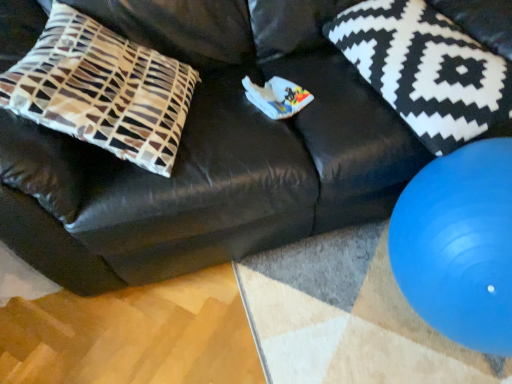
Question: Is brown and white patterned pillow at left, which ranks as the 1th pillow in left-to-right order, at the left side of blue rubber ball at lower right?

Choices:
 (A) yes
 (B) no

Answer: (A)

Question: Is brown and white patterned pillow at left, the 2th pillow from the right, facing away from blue rubber ball at lower right?

Choices:
 (A) no
 (B) yes

Answer: (A)

Question: Considering the relative positions of brown and white patterned pillow at left, which ranks as the 1th pillow in left-to-right order, and blue rubber ball at lower right in the image provided, is brown and white patterned pillow at left, which ranks as the 1th pillow in left-to-right order, in front of blue rubber ball at lower right?

Choices:
 (A) yes
 (B) no

Answer: (B)

Question: Does brown and white patterned pillow at left, the 2th pillow from the right, have a smaller size compared to blue rubber ball at lower right?

Choices:
 (A) yes
 (B) no

Answer: (B)

Question: Is brown and white patterned pillow at left, which ranks as the 1th pillow in left-to-right order, far away from blue rubber ball at lower right?

Choices:
 (A) yes
 (B) no

Answer: (B)

Question: Do you think black and white patterned pillow at upper right, the first pillow from the right, is within brown and white patterned pillow at left, which ranks as the 1th pillow in left-to-right order, or outside of it?

Choices:
 (A) inside
 (B) outside

Answer: (B)

Question: From a real-world perspective, is black and white patterned pillow at upper right, the first pillow from the right, above or below brown and white patterned pillow at left, which ranks as the 1th pillow in left-to-right order?

Choices:
 (A) above
 (B) below

Answer: (B)

Question: Considering the positions of black and white patterned pillow at upper right, the 2th pillow positioned from the left, and brown and white patterned pillow at left, the 2th pillow from the right, in the image, is black and white patterned pillow at upper right, the 2th pillow positioned from the left, taller or shorter than brown and white patterned pillow at left, the 2th pillow from the right,?

Choices:
 (A) tall
 (B) short

Answer: (B)

Question: Is point (471, 74) positioned closer to the camera than point (55, 124)?

Choices:
 (A) farther
 (B) closer

Answer: (A)

Question: Is point (481, 226) closer or farther from the camera than point (352, 24)?

Choices:
 (A) closer
 (B) farther

Answer: (A)

Question: From a real-world perspective, is blue rubber ball at lower right physically located above or below black and white patterned pillow at upper right, the first pillow from the right?

Choices:
 (A) above
 (B) below

Answer: (B)

Question: In the image, is blue rubber ball at lower right positioned in front of or behind black and white patterned pillow at upper right, the first pillow from the right?

Choices:
 (A) front
 (B) behind

Answer: (A)

Question: Is blue rubber ball at lower right to the left or to the right of black and white patterned pillow at upper right, the 2th pillow positioned from the left, in the image?

Choices:
 (A) right
 (B) left

Answer: (A)

Question: From a real-world perspective, is brown and white patterned pillow at left, the 2th pillow from the right, above or below blue rubber ball at lower right?

Choices:
 (A) below
 (B) above

Answer: (B)

Question: From their relative heights in the image, would you say brown and white patterned pillow at left, which ranks as the 1th pillow in left-to-right order, is taller or shorter than blue rubber ball at lower right?

Choices:
 (A) short
 (B) tall

Answer: (B)